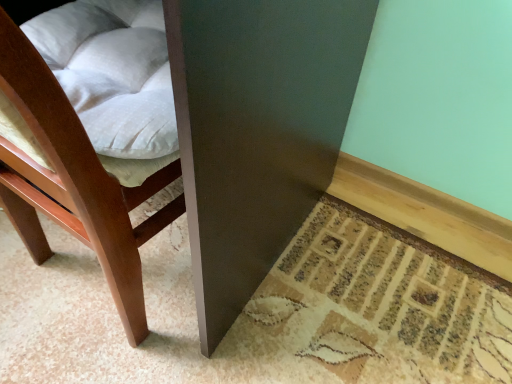
Question: Is matte dark brown table at lower center at the back of matte wood chair at lower left?

Choices:
 (A) yes
 (B) no

Answer: (A)

Question: From a real-world perspective, is matte wood chair at lower left positioned under matte dark brown table at lower center based on gravity?

Choices:
 (A) yes
 (B) no

Answer: (A)

Question: Can you confirm if matte wood chair at lower left is wider than matte dark brown table at lower center?

Choices:
 (A) no
 (B) yes

Answer: (A)

Question: Is matte wood chair at lower left shorter than matte dark brown table at lower center?

Choices:
 (A) no
 (B) yes

Answer: (B)

Question: Does matte wood chair at lower left lie behind matte dark brown table at lower center?

Choices:
 (A) no
 (B) yes

Answer: (A)

Question: Can we say matte wood chair at lower left lies outside matte dark brown table at lower center?

Choices:
 (A) no
 (B) yes

Answer: (A)

Question: Is matte dark brown table at lower center in contact with matte wood chair at lower left?

Choices:
 (A) no
 (B) yes

Answer: (A)

Question: Is matte dark brown table at lower center oriented away from matte wood chair at lower left?

Choices:
 (A) yes
 (B) no

Answer: (B)

Question: From a real-world perspective, is matte dark brown table at lower center on matte wood chair at lower left?

Choices:
 (A) yes
 (B) no

Answer: (A)

Question: Is matte dark brown table at lower center outside matte wood chair at lower left?

Choices:
 (A) no
 (B) yes

Answer: (B)

Question: Is matte wood chair at lower left located within matte dark brown table at lower center?

Choices:
 (A) yes
 (B) no

Answer: (A)

Question: Is matte dark brown table at lower center thinner than matte wood chair at lower left?

Choices:
 (A) yes
 (B) no

Answer: (B)

Question: From the image's perspective, is matte dark brown table at lower center located above or below matte wood chair at lower left?

Choices:
 (A) above
 (B) below

Answer: (A)